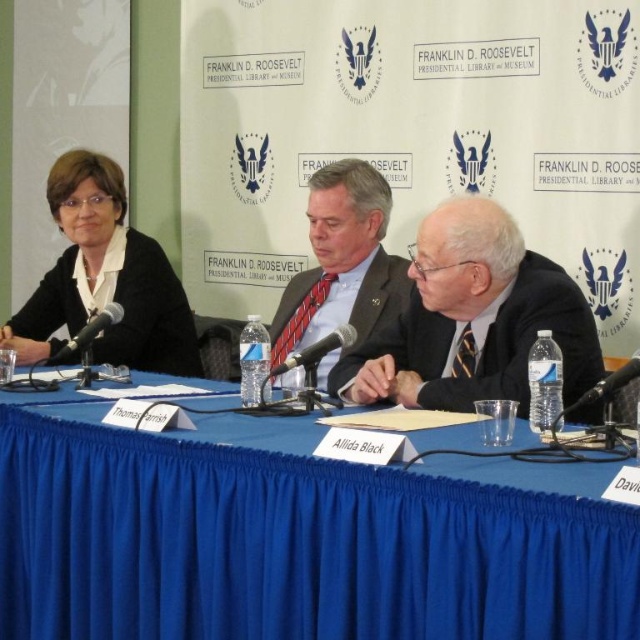
You are attending the panel discussion at the Franklin D. Roosevelt Presidential Library and Museum and notice two attendees wearing formal attire. The first is wearing a matte black jacket at left, and the other is wearing a matte gray suit at center. Based on the description, which attendee has a taller garment?

The matte black jacket at left is taller than the matte gray suit at center, so the attendee wearing the matte black jacket at left has a taller garment.

You are attending the panel discussion at the Franklin D. Roosevelt Presidential Library and Museum and notice two individuals wearing a dark suit at center and a matte gray suit at center. Which one is sitting closer to the front of the table?

The dark suit at center is sitting closer to the front of the table because it is positioned under the matte gray suit at center, indicating it is in a lower, more forward position.

You are organizing a small meeting and need to seat two people at the blue fabric table at center. Given that the matte gray suit at center is currently occupying part of the table, will there be enough space for both attendees?

The blue fabric table at center has a larger width than the matte gray suit at center, so there should be sufficient space to seat two people even with the suit taking up some of the table area.